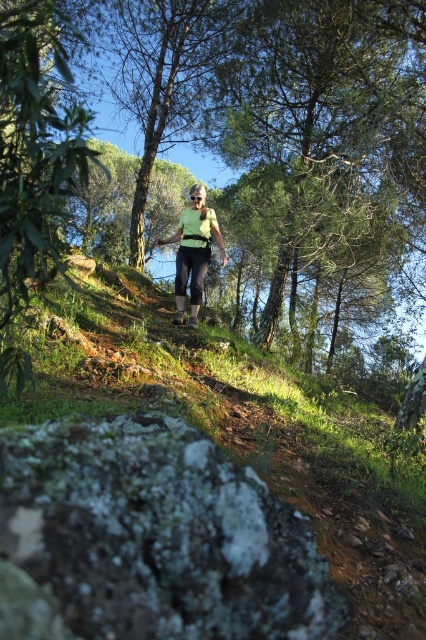
Between green leafy tree at upper center and green mossy rock at lower left, which one appears on the left side from the viewer's perspective?

green mossy rock at lower left

Identify the location of green leafy tree at upper center. click(x=294, y=152).

Does green leafy tree at upper center have a greater height compared to green matte vest at center?

Yes, green leafy tree at upper center is taller than green matte vest at center.

Who is more forward, (189, 17) or (195, 314)?

Positioned in front is point (195, 314).

Where is `green leafy tree at upper center`? This screenshot has width=426, height=640. green leafy tree at upper center is located at coordinates (294, 152).

Does green mossy rock at lower left have a larger size compared to green matte vest at center?

Yes.

Does point (86, 465) come behind point (181, 262)?

No, (86, 465) is in front of (181, 262).

Find the location of `green mossy rock at lower left`. green mossy rock at lower left is located at coordinates (158, 534).

Locate an element on the screen. green mossy rock at lower left is located at coordinates (158, 534).